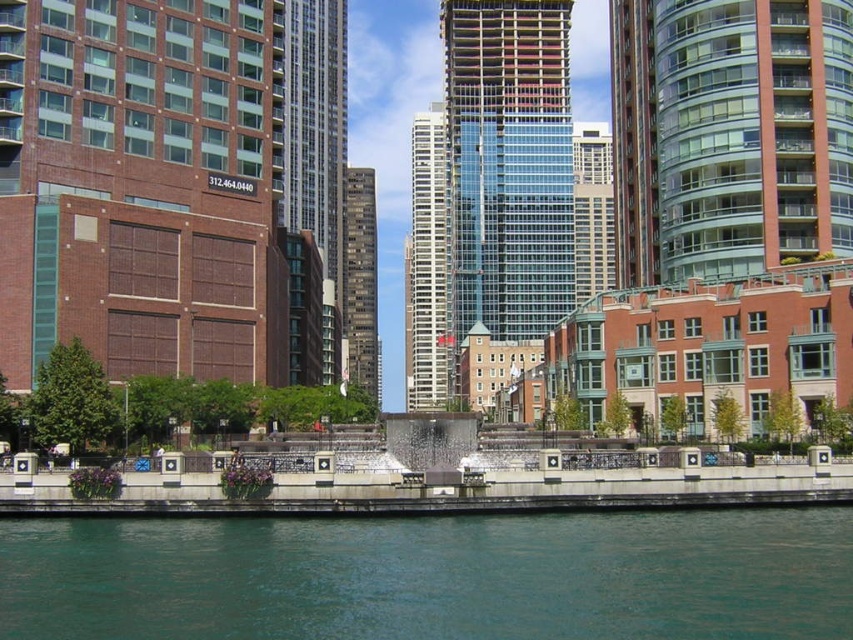
You are a photographer planning to capture the skyline of the waterfront area. You have a camera with a limited zoom range that can only focus on taller structures. Which of the two buildings, the glassy steel skyscraper at center or the dark gray concrete building at center, should you aim your camera at to ensure it captures the taller one?

The glassy steel skyscraper at center is taller than the dark gray concrete building at center, so you should aim your camera at the glassy steel skyscraper at center to capture the taller one.

You are standing at the point with coordinates point (x=508, y=164) in the urban waterfront scene. What object are you facing?

The point (x=508, y=164) corresponds to the glassy reflective skyscraper at center, so you are facing the glassy reflective skyscraper at center.